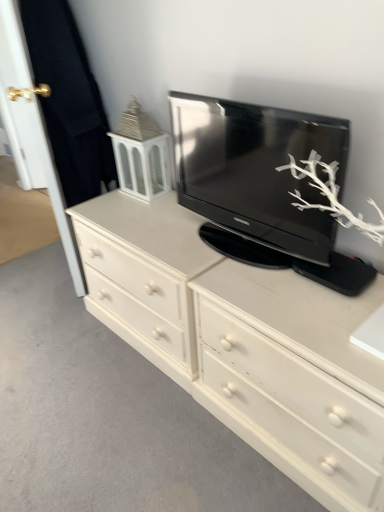
Image resolution: width=384 pixels, height=512 pixels. Find the location of `white matte drawer at center`. white matte drawer at center is located at coordinates (294, 403).

Measure the distance between white painted wood tv cabinet at upper left and camera.

They are 5.70 feet apart.

This screenshot has width=384, height=512. Identify the location of black glossy television at center. (256, 170).

At what (x,y) coordinates should I click in order to perform the action: click on white wood door at left, arranged as the second door when viewed from the left. Please return your answer as a coordinate pair (x, y). This screenshot has width=384, height=512. Looking at the image, I should click on (55, 195).

The image size is (384, 512). I want to click on white matte drawer at center, so click(294, 403).

In the scene shown: Considering the sizes of gold metallic door handle at upper left, which is counted as the second door, starting from the right, and white painted wood chest of drawers at center in the image, is gold metallic door handle at upper left, which is counted as the second door, starting from the right, taller or shorter than white painted wood chest of drawers at center?

In the image, gold metallic door handle at upper left, which is counted as the second door, starting from the right, appears to be taller than white painted wood chest of drawers at center.

At what (x,y) coordinates should I click in order to perform the action: click on the chest of drawers below the gold metallic door handle at upper left, the first door when ordered from left to right (from the image's perspective). Please return your answer as a coordinate pair (x, y). This screenshot has height=512, width=384. Looking at the image, I should click on (243, 343).

Between gold metallic door handle at upper left, which is counted as the second door, starting from the right, and white painted wood chest of drawers at center, which one has smaller size?

white painted wood chest of drawers at center is smaller.

From a real-world perspective, who is located lower, gold metallic door handle at upper left, the first door when ordered from left to right, or white painted wood chest of drawers at center?

white painted wood chest of drawers at center is physically lower.

Locate an element on the screen. Image resolution: width=384 pixels, height=512 pixels. television on the right of white painted wood chest of drawers at center is located at coordinates (256, 170).

From a real-world perspective, is white painted wood chest of drawers at center under black glossy television at center?

Yes.

Which of these two, white painted wood chest of drawers at center or black glossy television at center, is thinner?

black glossy television at center.

Can you confirm if white wood door at left, which is counted as the first door, starting from the right, is smaller than black glossy television at center?

Actually, white wood door at left, which is counted as the first door, starting from the right, might be larger than black glossy television at center.

From the picture: Considering the relative positions of white wood door at left, which is counted as the first door, starting from the right, and black glossy television at center in the image provided, is white wood door at left, which is counted as the first door, starting from the right, in front of black glossy television at center?

No, white wood door at left, which is counted as the first door, starting from the right, is further to the viewer.

From the picture: Is white wood door at left, which is counted as the first door, starting from the right, far away from black glossy television at center?

No, white wood door at left, which is counted as the first door, starting from the right, is not far away from black glossy television at center.

From a real-world perspective, is white wood door at left, arranged as the second door when viewed from the left, physically above black glossy television at center?

No.

In terms of width, does white painted wood chest of drawers at center look wider or thinner when compared to white painted wood tv cabinet at upper left?

Considering their sizes, white painted wood chest of drawers at center looks broader than white painted wood tv cabinet at upper left.

Between white painted wood chest of drawers at center and white painted wood tv cabinet at upper left, which one appears on the right side from the viewer's perspective?

From the viewer's perspective, white painted wood tv cabinet at upper left appears more on the right side.

Is point (229, 376) closer or farther from the camera than point (165, 145)?

Point (229, 376) is positioned closer to the camera compared to point (165, 145).

Is white painted wood chest of drawers at center turned away from white painted wood tv cabinet at upper left?

white painted wood chest of drawers at center is not turned away from white painted wood tv cabinet at upper left.

Based on the photo, would you consider white painted wood tv cabinet at upper left to be distant from white wood door at left, which is counted as the first door, starting from the right?

Actually, white painted wood tv cabinet at upper left and white wood door at left, which is counted as the first door, starting from the right, are a little close together.

Who is bigger, white painted wood tv cabinet at upper left or white wood door at left, which is counted as the first door, starting from the right?

white wood door at left, which is counted as the first door, starting from the right, is bigger.

Is white painted wood tv cabinet at upper left positioned with its back to white wood door at left, which is counted as the first door, starting from the right?

No.

Considering the relative positions of white painted wood tv cabinet at upper left and white wood door at left, which is counted as the first door, starting from the right, in the image provided, is white painted wood tv cabinet at upper left to the right of white wood door at left, which is counted as the first door, starting from the right, from the viewer's perspective?

Yes.

From a real-world perspective, who is located lower, white matte drawer at center or white wood door at left, arranged as the second door when viewed from the left?

From a 3D spatial view, white matte drawer at center is below.

Which of these two, white matte drawer at center or white wood door at left, which is counted as the first door, starting from the right, is bigger?

white matte drawer at center is bigger.

How many degrees apart are the facing directions of white matte drawer at center and white wood door at left, which is counted as the first door, starting from the right?

29.5 degrees separate the facing orientations of white matte drawer at center and white wood door at left, which is counted as the first door, starting from the right.

Between white matte drawer at center and white wood door at left, arranged as the second door when viewed from the left, which one is positioned in front?

white matte drawer at center.

From the picture: Is black glossy television at center aimed at white wood door at left, which is counted as the first door, starting from the right?

No, black glossy television at center does not turn towards white wood door at left, which is counted as the first door, starting from the right.

In terms of width, does black glossy television at center look wider or thinner when compared to white wood door at left, arranged as the second door when viewed from the left?

In the image, black glossy television at center appears to be wider than white wood door at left, arranged as the second door when viewed from the left.

From a real-world perspective, which is physically above, black glossy television at center or white wood door at left, arranged as the second door when viewed from the left?

From a 3D spatial view, black glossy television at center is above.

I want to click on the chest of drawers located underneath the gold metallic door handle at upper left, which is counted as the second door, starting from the right (from a real-world perspective), so click(x=243, y=343).

This screenshot has height=512, width=384. Find the location of `television on the right of the white painted wood chest of drawers at center`. television on the right of the white painted wood chest of drawers at center is located at coordinates (256, 170).

Estimate the real-world distances between objects in this image. Which object is further from white painted wood chest of drawers at center, black glossy television at center or white painted wood tv cabinet at upper left?

white painted wood tv cabinet at upper left lies further to white painted wood chest of drawers at center than the other object.

From the image, which object appears to be farther from gold metallic door handle at upper left, which is counted as the second door, starting from the right, white painted wood chest of drawers at center or white wood door at left, which is counted as the first door, starting from the right?

The object further to gold metallic door handle at upper left, which is counted as the second door, starting from the right, is white painted wood chest of drawers at center.

Considering their positions, is white painted wood tv cabinet at upper left positioned closer to white matte drawer at center than black glossy television at center?

Among the two, black glossy television at center is located nearer to white matte drawer at center.

Estimate the real-world distances between objects in this image. Which object is further from gold metallic door handle at upper left, the first door when ordered from left to right, white painted wood tv cabinet at upper left or white painted wood chest of drawers at center?

Among the two, white painted wood chest of drawers at center is located further to gold metallic door handle at upper left, the first door when ordered from left to right.

From the image, which object appears to be nearer to black glossy television at center, white painted wood tv cabinet at upper left or white wood door at left, which is counted as the first door, starting from the right?

white painted wood tv cabinet at upper left is positioned closer to the anchor black glossy television at center.

Which object lies nearer to the anchor point white wood door at left, which is counted as the first door, starting from the right, white painted wood tv cabinet at upper left or gold metallic door handle at upper left, which is counted as the second door, starting from the right?

Based on the image, white painted wood tv cabinet at upper left appears to be nearer to white wood door at left, which is counted as the first door, starting from the right.

When comparing their distances from white wood door at left, which is counted as the first door, starting from the right, does black glossy television at center or white matte drawer at center seem closer?

black glossy television at center is closer to white wood door at left, which is counted as the first door, starting from the right.

Based on their spatial positions, is white wood door at left, which is counted as the first door, starting from the right, or white painted wood chest of drawers at center further from black glossy television at center?

white wood door at left, which is counted as the first door, starting from the right, is further to black glossy television at center.

The height and width of the screenshot is (512, 384). In order to click on tv cabinet between gold metallic door handle at upper left, the first door when ordered from left to right, and white matte drawer at center, in the horizontal direction in this screenshot , I will do point(141,154).

Locate an element on the screen. drawer that lies between white painted wood tv cabinet at upper left and white painted wood chest of drawers at center from top to bottom is located at coordinates (294, 403).

This screenshot has height=512, width=384. In order to click on door between white painted wood chest of drawers at center and gold metallic door handle at upper left, which is counted as the second door, starting from the right, in the front-back direction in this screenshot , I will do `click(55, 195)`.

At what (x,y) coordinates should I click in order to perform the action: click on tv cabinet located between white wood door at left, which is counted as the first door, starting from the right, and gold metallic door handle at upper left, which is counted as the second door, starting from the right, in the depth direction. Please return your answer as a coordinate pair (x, y). Looking at the image, I should click on (141, 154).